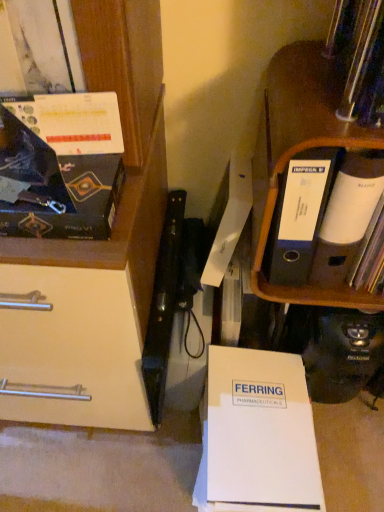
Question: In terms of width, does black cardboard file at upper right look wider or thinner when compared to matte black magazine at upper left?

Choices:
 (A) wide
 (B) thin

Answer: (A)

Question: Looking at the image, does black cardboard file at upper right seem bigger or smaller compared to matte black magazine at upper left?

Choices:
 (A) small
 (B) big

Answer: (B)

Question: Which object is the closest to the black cardboard file at upper right?

Choices:
 (A) white paper at lower center
 (B) matte black magazine at upper left

Answer: (B)

Question: Based on their relative distances, which object is farther from the white paper at lower center?

Choices:
 (A) matte black magazine at upper left
 (B) black cardboard file at upper right

Answer: (A)